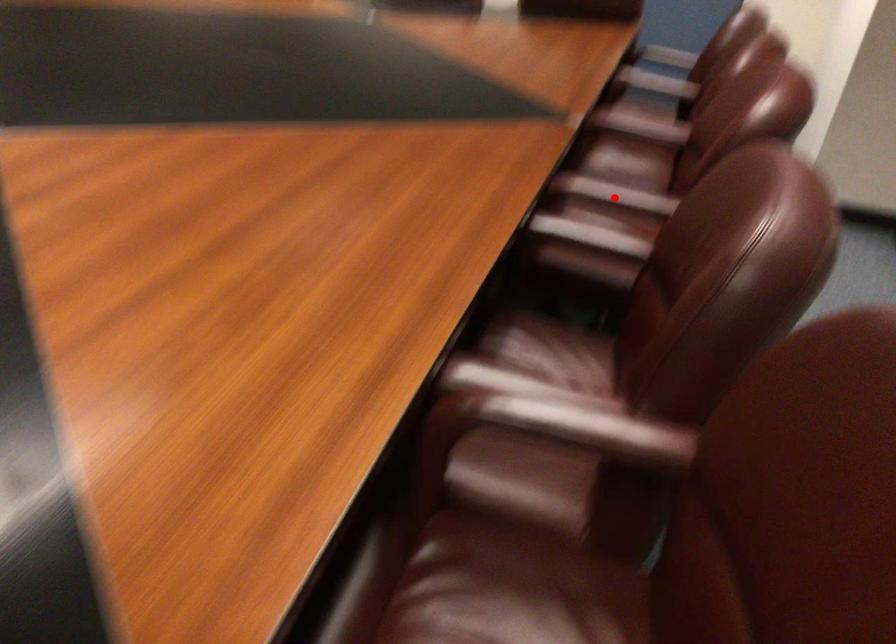
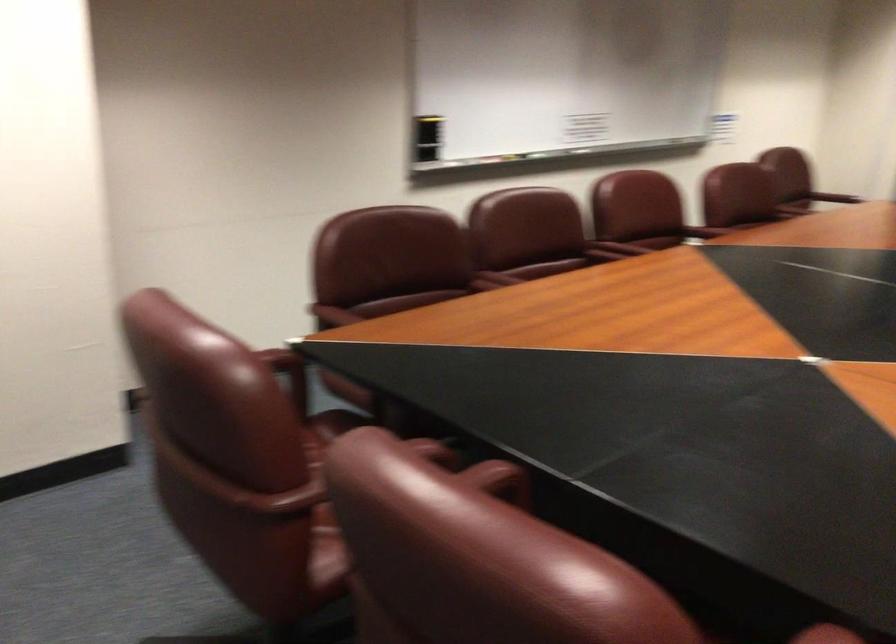
Question: I am providing you with two images of the same scene from different viewpoints. A red point is marked on the first image. Is the red point's position out of view in image 2?

Choices:
 (A) Yes
 (B) No

Answer: (B)